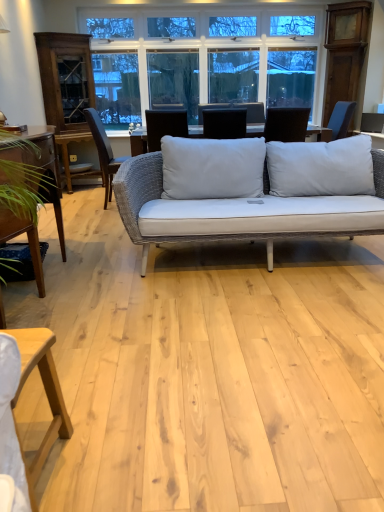
Question: From a real-world perspective, is matte black laptop at center, which is counted as the first chair, starting from the right, physically located above or below white glass window at upper center?

Choices:
 (A) above
 (B) below

Answer: (B)

Question: Is point (231, 138) closer or farther from the camera than point (274, 33)?

Choices:
 (A) farther
 (B) closer

Answer: (B)

Question: Which object is the closest to the wooden table at left, marked as the 2th table in a front-to-back arrangement?

Choices:
 (A) matte black laptop at center, the second chair viewed from the back
 (B) dark brown wood chair at left, arranged as the first chair when viewed from the back
 (C) white glass window at upper center
 (D) light wood table at lower left, which is the 1th table in front-to-back order

Answer: (D)

Question: Which is farther from the white glass window at upper center?

Choices:
 (A) light wood table at lower left, which is the 1th table in front-to-back order
 (B) dark brown wood chair at left, placed as the second chair when sorted from right to left
 (C) matte black laptop at center, the 2th chair positioned from the left
 (D) wooden table at left, which is the 1th table in left-to-right order

Answer: (A)